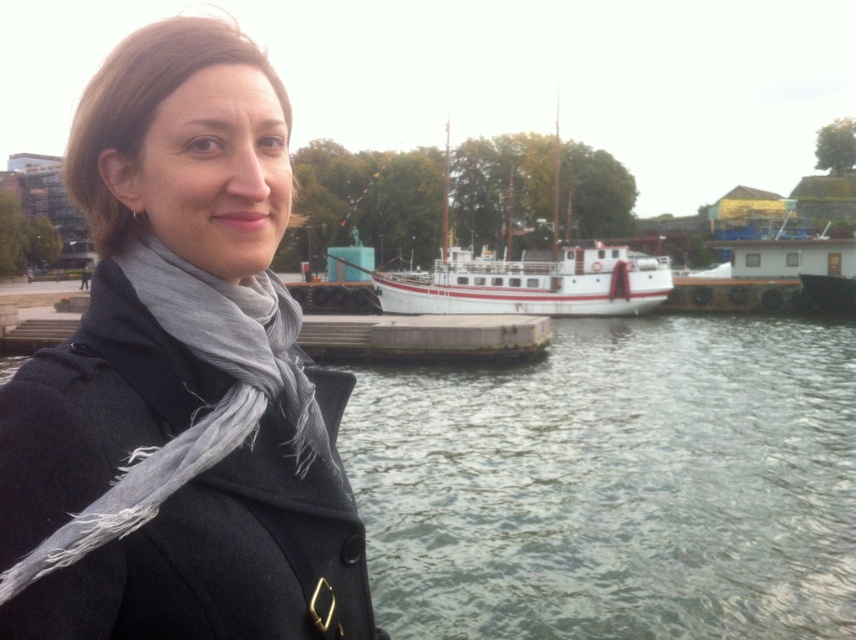
You are a photographer positioned at the waterfront scene. You want to capture a closeup of the gray fringed scarf at left without including the person wearing it. Considering your current position, can you move closer to the scarf to achieve this shot?

The gray fringed scarf at left is 1.60 meters away from the viewer. Since you need to get closer than that distance to capture a closeup, you can move forward to reduce the distance between yourself and the scarf, ensuring it fills the frame without the person being in the shot.

You are a photographer planning to take a photo of the greenish water at lower center and the white matte boat at center. Based on their positions, which object should you focus on first if you want to capture both in a single shot without moving the camera?

The greenish water at lower center is located below the white matte boat at center, so you should focus on the white matte boat at center first as it is higher up, allowing the camera to naturally include the greenish water at lower center in the frame.

You are a photographer trying to capture the gray fringed scarf at left and the white matte boat at center in the same frame. Based on their positions, which object is closer to the camera?

The gray fringed scarf at left is positioned under the white matte boat at center, so it is closer to the camera.